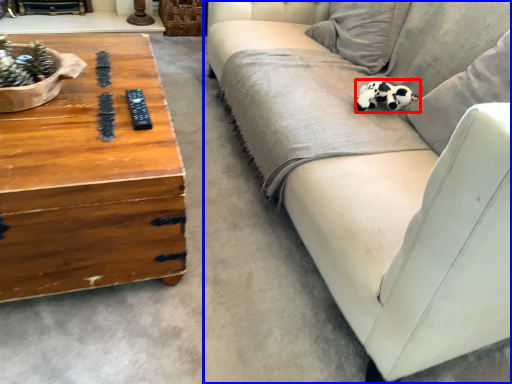
Question: Among these objects, which one is farthest to the camera, animal (highlighted by a red box) or studio couch (highlighted by a blue box)?

Choices:
 (A) animal
 (B) studio couch

Answer: (A)